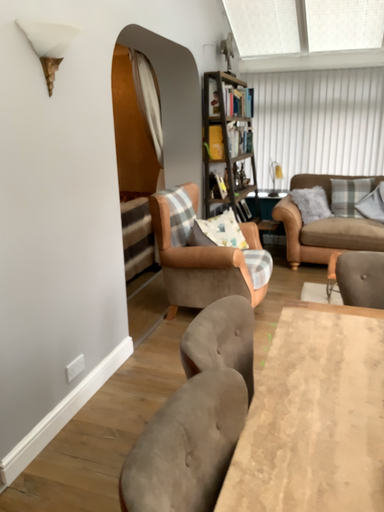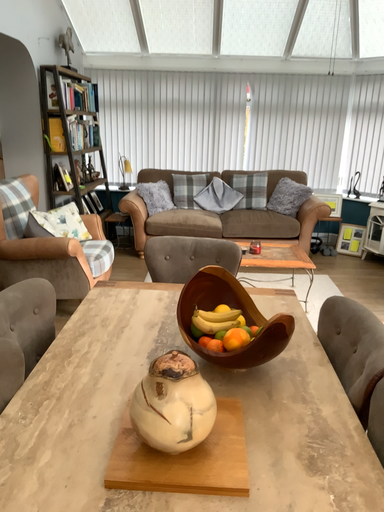
Question: How did the camera likely rotate when shooting the video?

Choices:
 (A) rotated right
 (B) rotated left

Answer: (A)